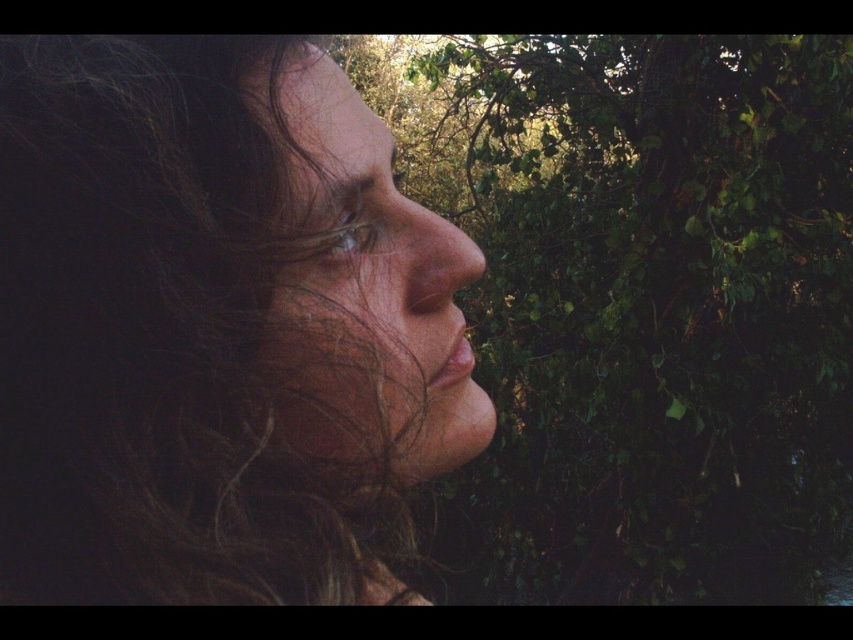
Question: Based on their relative distances, which object is nearer to the dark curly hair at left?

Choices:
 (A) green leafy tree at right
 (B) smooth skin face at center

Answer: (B)

Question: From the image, what is the correct spatial relationship of dark curly hair at left in relation to smooth skin face at center?

Choices:
 (A) below
 (B) above

Answer: (A)

Question: Is green leafy tree at right in front of smooth skin face at center?

Choices:
 (A) no
 (B) yes

Answer: (A)

Question: Which point appears closest to the camera in this image?

Choices:
 (A) (552, 244)
 (B) (288, 276)
 (C) (312, 314)

Answer: (C)

Question: Which object is positioned closest to the dark curly hair at left?

Choices:
 (A) smooth skin face at center
 (B) green leafy tree at right

Answer: (A)

Question: Does dark curly hair at left have a lesser width compared to smooth skin face at center?

Choices:
 (A) no
 (B) yes

Answer: (A)